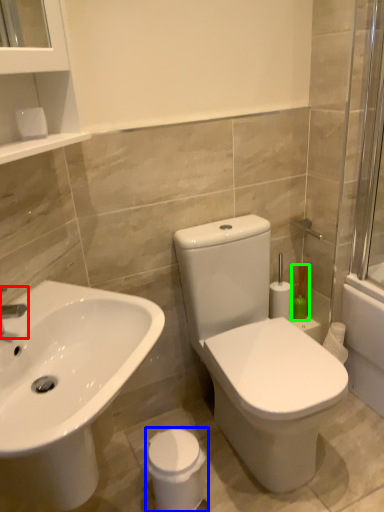
Question: Which is farther away from tap (highlighted by a red box)? porcelain (highlighted by a blue box) or soap dispenser (highlighted by a green box)?

Choices:
 (A) porcelain
 (B) soap dispenser

Answer: (B)